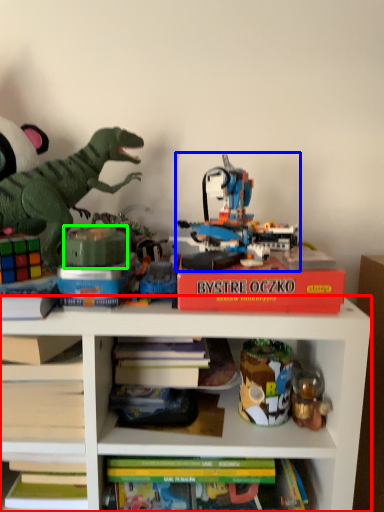
Question: Considering the real-world distances, which object is farthest from shelf (highlighted by a red box)? toy (highlighted by a blue box) or toy (highlighted by a green box)?

Choices:
 (A) toy
 (B) toy

Answer: (B)